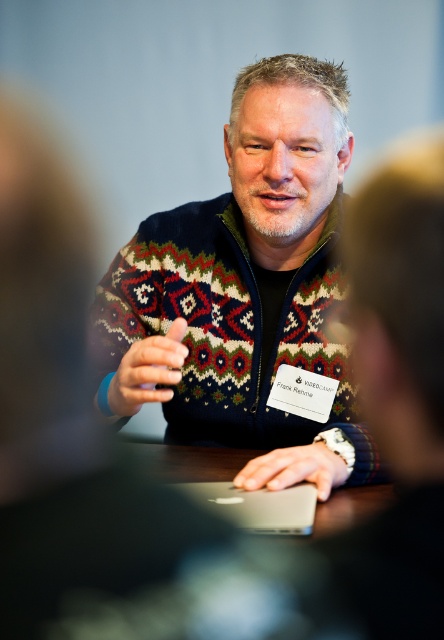
Question: Does silver metallic laptop at center appear under satin silver mouse at center?

Choices:
 (A) yes
 (B) no

Answer: (A)

Question: Which point is farther to the camera?

Choices:
 (A) knitted sweater at center
 (B) satin silver mouse at center
 (C) silver metallic laptop at center

Answer: (B)

Question: Is knitted sweater at center further to the viewer compared to satin silver mouse at center?

Choices:
 (A) no
 (B) yes

Answer: (A)

Question: Considering the real-world distances, which object is farthest from the matte black hand at center?

Choices:
 (A) knitted sweater at center
 (B) silver metallic laptop at center
 (C) satin silver mouse at center

Answer: (C)

Question: Can you confirm if silver metallic laptop at center is positioned below matte black hand at center?

Choices:
 (A) no
 (B) yes

Answer: (B)

Question: Among these objects, which one is farthest from the camera?

Choices:
 (A) silver metallic laptop at center
 (B) knitted sweater at center
 (C) matte black hand at center
 (D) satin silver mouse at center

Answer: (D)